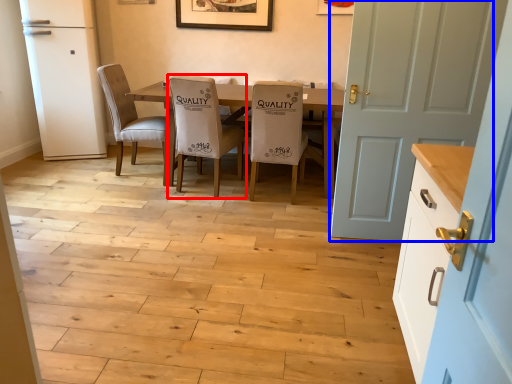
Question: Which object appears farthest to the camera in this image, chair (highlighted by a red box) or door (highlighted by a blue box)?

Choices:
 (A) chair
 (B) door

Answer: (A)